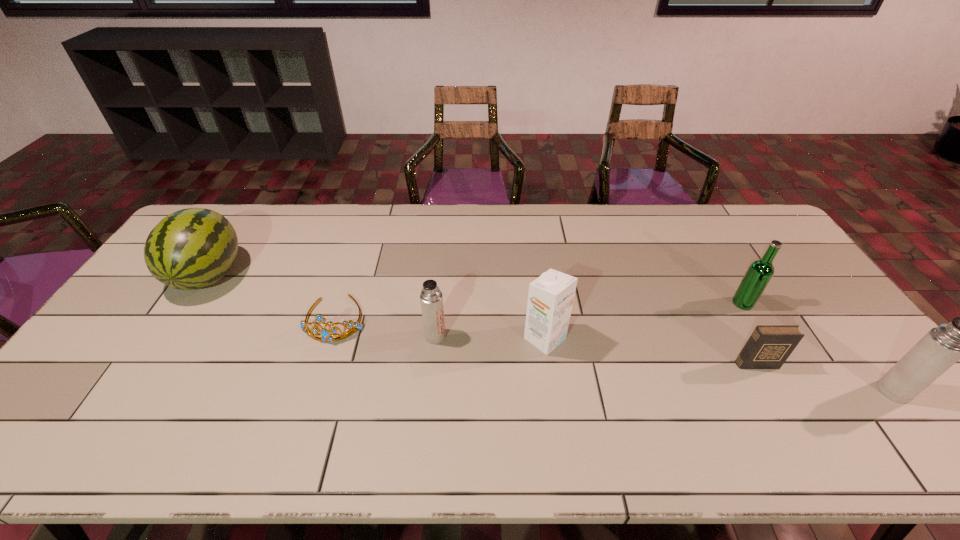
If equal spacing is desired by inserting an extra thermos_bottle among them, please point out a free spot for this new thermos_bottle. Please provide its 2D coordinates. Your answer should be formatted as a tuple, i.e. [(x, y)], where the tuple contains the x and y coordinates of a point satisfying the conditions above.

[(652, 362)]